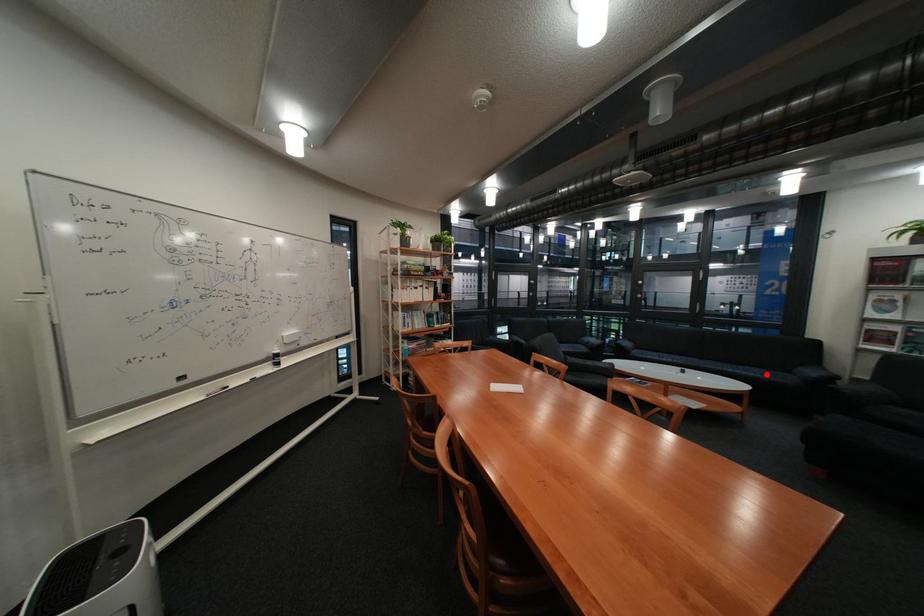
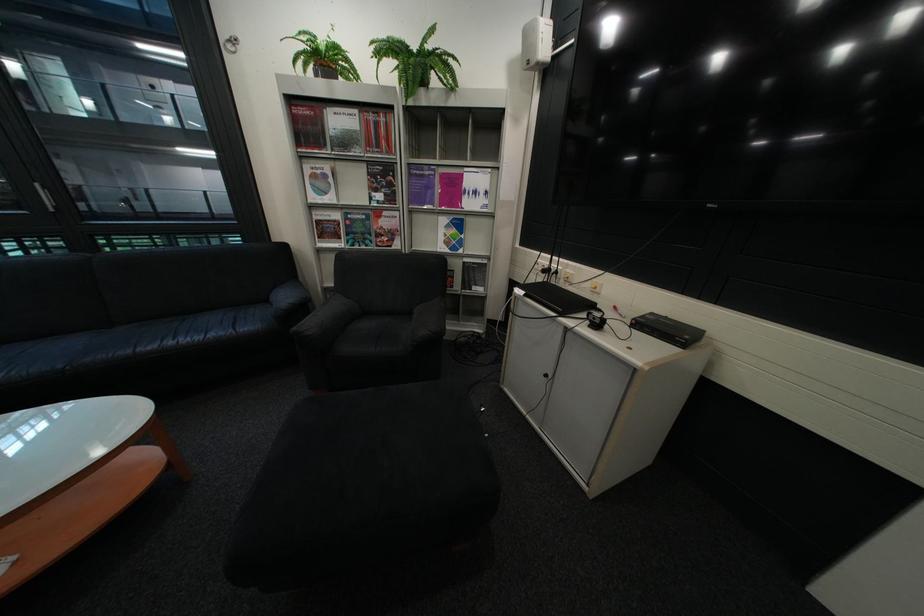
Where in the second image is the point corresponding to the highlighted location from the first image?

(213, 338)